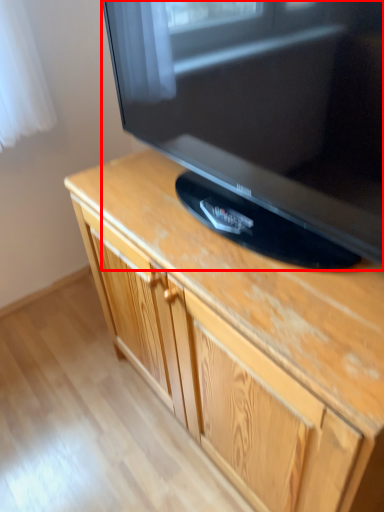
Question: Considering the relative positions of television (annotated by the red box) and cabinetry in the image provided, where is television (annotated by the red box) located with respect to the staircase?

Choices:
 (A) right
 (B) left

Answer: (B)